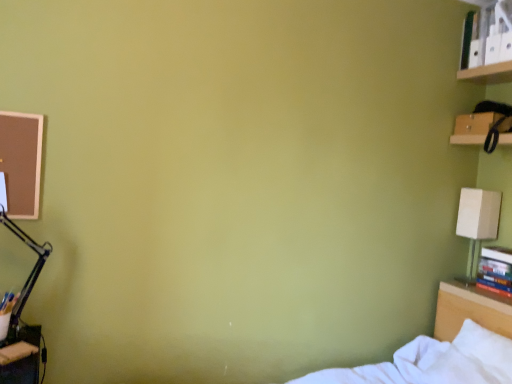
Question: Is white cardboard book at upper right, marked as the second book in a bottom-to-top arrangement, positioned beyond the bounds of beige fabric lampshade at upper right?

Choices:
 (A) no
 (B) yes

Answer: (B)

Question: Can you confirm if white cardboard book at upper right, marked as the second book in a bottom-to-top arrangement, is wider than beige fabric lampshade at upper right?

Choices:
 (A) no
 (B) yes

Answer: (A)

Question: Considering the relative sizes of white cardboard book at upper right, arranged as the 1th book when viewed from the top, and beige fabric lampshade at upper right in the image provided, is white cardboard book at upper right, arranged as the 1th book when viewed from the top, shorter than beige fabric lampshade at upper right?

Choices:
 (A) no
 (B) yes

Answer: (B)

Question: Is white cardboard book at upper right, marked as the second book in a bottom-to-top arrangement, to the left of beige fabric lampshade at upper right from the viewer's perspective?

Choices:
 (A) no
 (B) yes

Answer: (B)

Question: From a real-world perspective, is white cardboard book at upper right, marked as the second book in a bottom-to-top arrangement, below beige fabric lampshade at upper right?

Choices:
 (A) yes
 (B) no

Answer: (B)

Question: Visually, is wooden desk at lower left positioned to the left or to the right of hardcover books at right, arranged as the first book when ordered from the bottom?

Choices:
 (A) left
 (B) right

Answer: (A)

Question: Considering the positions of wooden desk at lower left and hardcover books at right, which appears as the second book when viewed from the top, in the image, is wooden desk at lower left taller or shorter than hardcover books at right, which appears as the second book when viewed from the top,?

Choices:
 (A) short
 (B) tall

Answer: (A)

Question: Is wooden desk at lower left spatially inside hardcover books at right, arranged as the first book when ordered from the bottom, or outside of it?

Choices:
 (A) outside
 (B) inside

Answer: (A)

Question: Considering the positions of wooden desk at lower left and hardcover books at right, which appears as the second book when viewed from the top, in the image, is wooden desk at lower left wider or thinner than hardcover books at right, which appears as the second book when viewed from the top,?

Choices:
 (A) thin
 (B) wide

Answer: (A)

Question: Is wooden desk at lower left in front of or behind white cardboard book at upper right, marked as the second book in a bottom-to-top arrangement, in the image?

Choices:
 (A) front
 (B) behind

Answer: (A)

Question: Considering the positions of wooden desk at lower left and white cardboard book at upper right, marked as the second book in a bottom-to-top arrangement, in the image, is wooden desk at lower left wider or thinner than white cardboard book at upper right, marked as the second book in a bottom-to-top arrangement,?

Choices:
 (A) thin
 (B) wide

Answer: (A)

Question: From a real-world perspective, relative to white cardboard book at upper right, arranged as the 1th book when viewed from the top, is wooden desk at lower left vertically above or below?

Choices:
 (A) above
 (B) below

Answer: (B)

Question: From the image's perspective, is wooden desk at lower left positioned above or below white cardboard book at upper right, marked as the second book in a bottom-to-top arrangement?

Choices:
 (A) above
 (B) below

Answer: (B)

Question: Is point (477, 26) positioned closer to the camera than point (509, 144)?

Choices:
 (A) closer
 (B) farther

Answer: (B)

Question: Considering the relative positions of white cardboard book at upper right, marked as the second book in a bottom-to-top arrangement, and wooden shelf at upper right in the image provided, is white cardboard book at upper right, marked as the second book in a bottom-to-top arrangement, to the left or to the right of wooden shelf at upper right?

Choices:
 (A) left
 (B) right

Answer: (A)